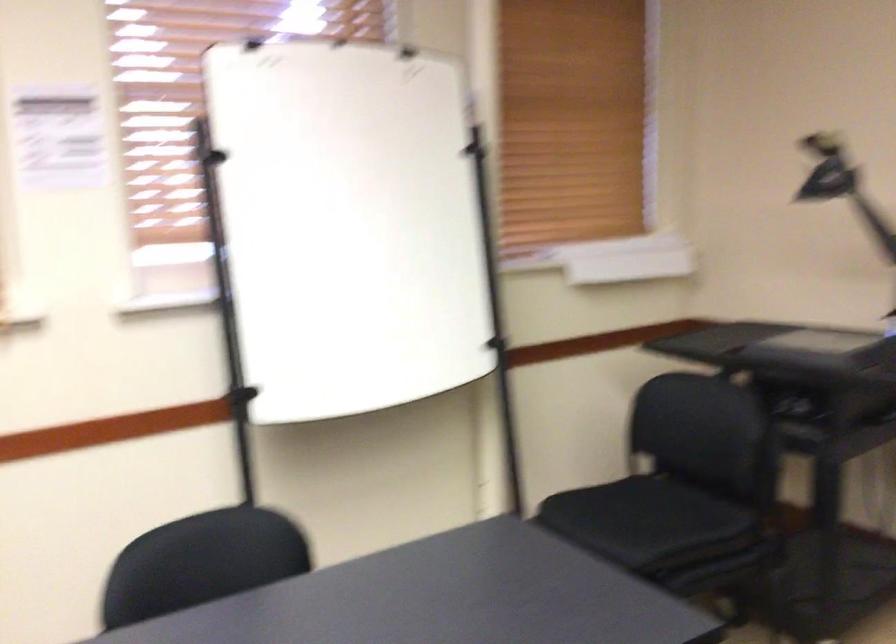
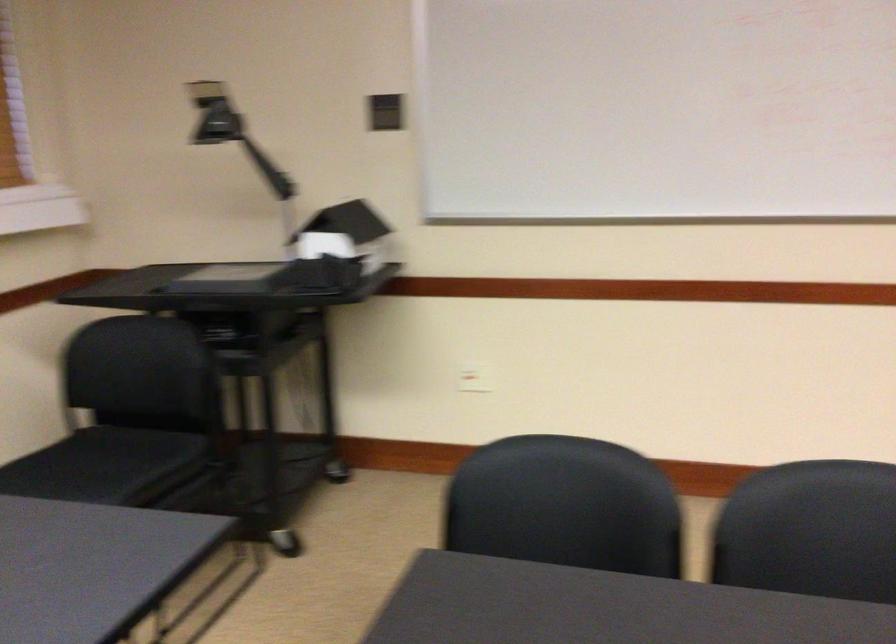
Question: The images are taken continuously from a first-person perspective. In which direction is your viewpoint rotating?

Choices:
 (A) Left
 (B) Right
 (C) Up
 (D) Down

Answer: (B)